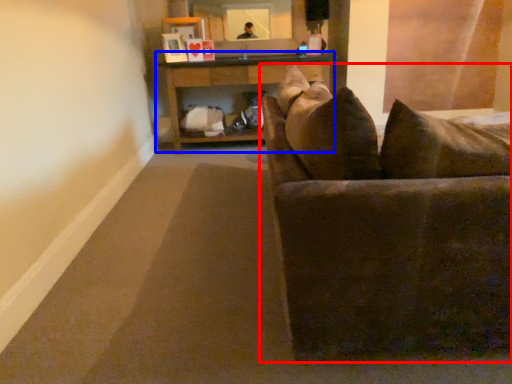
Question: Which of the following is the farthest to the observer, studio couch (highlighted by a red box) or table (highlighted by a blue box)?

Choices:
 (A) studio couch
 (B) table

Answer: (B)